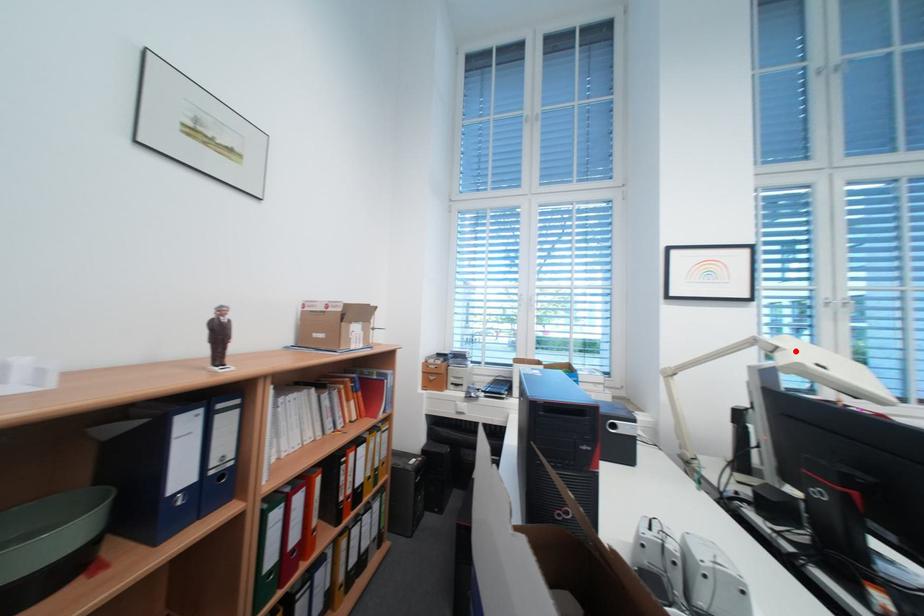
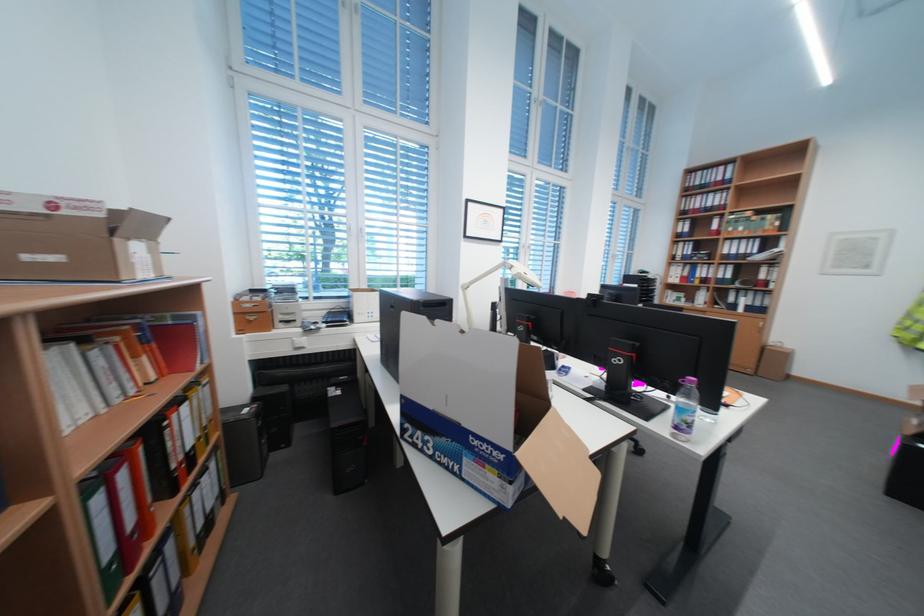
The point at the highlighted location is marked in the first image. Where is the corresponding point in the second image?

(526, 268)